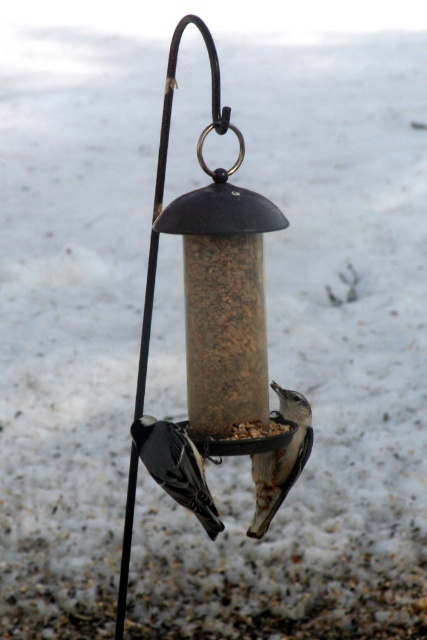
You are a birdwatcher observing the black matte bird at lower left and the white speckled bird at center on the feeder. Which bird is shorter in height?

The black matte bird at lower left is shorter in height compared to the white speckled bird at center.

You are a birder observing the scene. You notice the black matte bird at lower left and the white speckled bird at center. Which bird is closer to you?

The black matte bird at lower left is closer to you because it is in front of the white speckled bird at center.